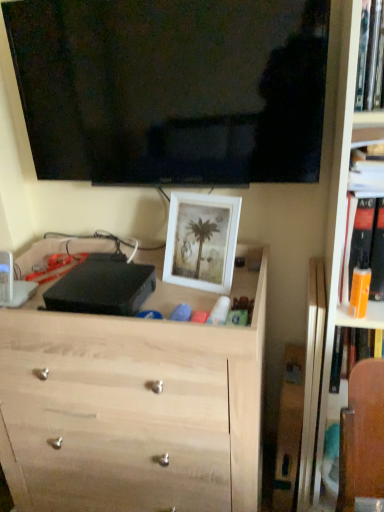
Question: Does point (367, 146) appear closer or farther from the camera than point (352, 262)?

Choices:
 (A) closer
 (B) farther

Answer: (A)

Question: Is hardcover book at upper right, which is counted as the second book, starting from the bottom, taller or shorter than orange plastic bottle at right, the first book from the bottom?

Choices:
 (A) tall
 (B) short

Answer: (B)

Question: Estimate the real-world distances between objects in this image. Which object is farther from the black glossy tv at upper center?

Choices:
 (A) orange plastic bottle at right, which ranks as the third book in top-to-bottom order
 (B) white matte picture frame at center
 (C) hardcover book at upper right, which ranks as the second book in top-to-bottom order
 (D) hardcover book at upper right, the first book positioned from the top
 (E) light wood chest of drawers at center

Answer: (E)

Question: Which object is positioned closest to the white matte picture frame at center?

Choices:
 (A) hardcover book at upper right, the first book positioned from the top
 (B) hardcover book at upper right, which is counted as the second book, starting from the bottom
 (C) black glossy tv at upper center
 (D) orange plastic bottle at right, the first book from the bottom
 (E) light wood chest of drawers at center

Answer: (C)